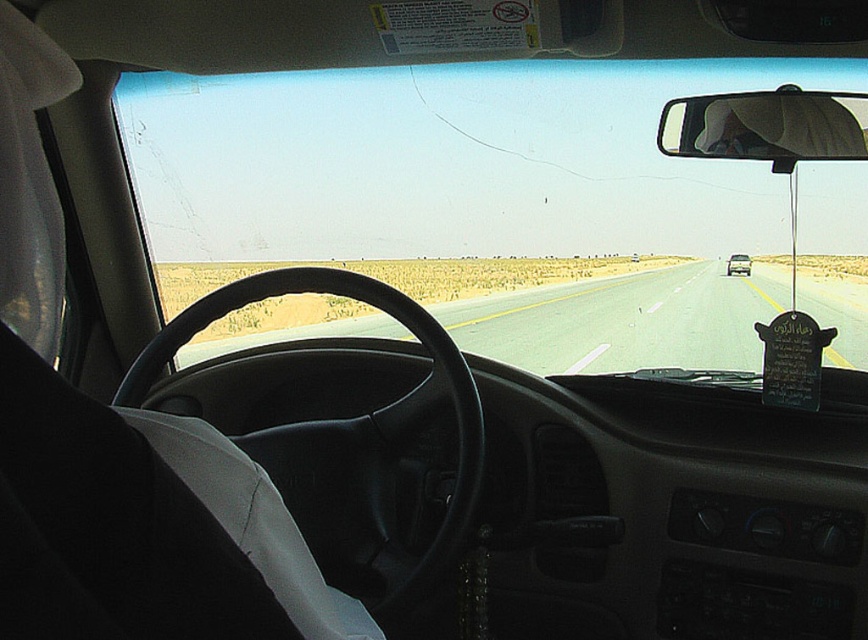
Question: Based on their relative distances, which object is nearer to the white glossy sedan at center?

Choices:
 (A) smooth asphalt highway at center
 (B) matte black rearview mirror at upper right

Answer: (A)

Question: Which of these objects is positioned farthest from the white glossy sedan at center?

Choices:
 (A) smooth asphalt highway at center
 (B) matte black rearview mirror at upper right
 (C) transparent glass windshield at center

Answer: (B)

Question: Does smooth asphalt highway at center appear on the left side of white glossy sedan at center?

Choices:
 (A) yes
 (B) no

Answer: (A)

Question: Can you confirm if transparent glass windshield at center is positioned to the left of white glossy sedan at center?

Choices:
 (A) yes
 (B) no

Answer: (A)

Question: Which object is farther from the camera taking this photo?

Choices:
 (A) smooth asphalt highway at center
 (B) matte black rearview mirror at upper right
 (C) white glossy sedan at center

Answer: (C)

Question: Can you confirm if transparent glass windshield at center is positioned above matte black rearview mirror at upper right?

Choices:
 (A) no
 (B) yes

Answer: (B)